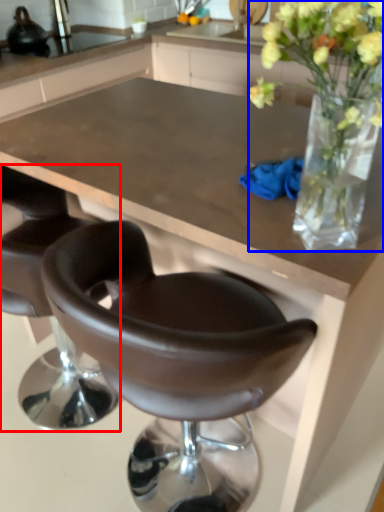
Question: Which object is further to the camera taking this photo, chair (highlighted by a red box) or floral arrangement (highlighted by a blue box)?

Choices:
 (A) chair
 (B) floral arrangement

Answer: (A)